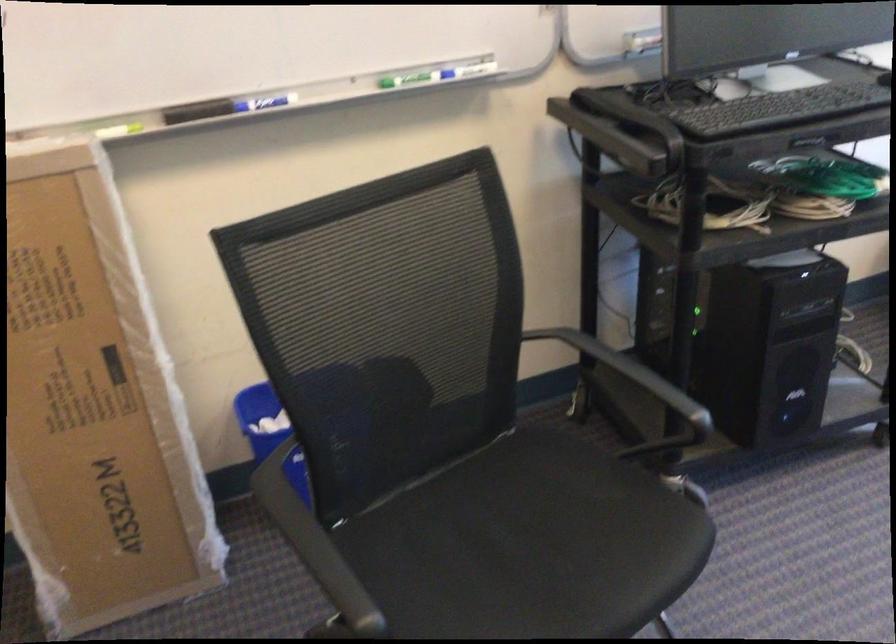
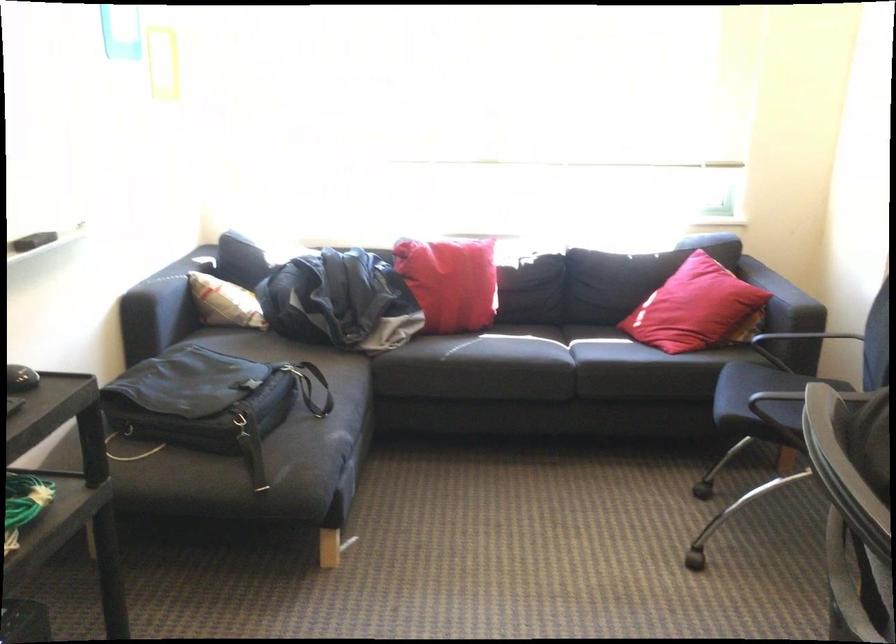
Question: The images are taken continuously from a first-person perspective. In which direction is your viewpoint rotating?

Choices:
 (A) Left
 (B) Right
 (C) Up
 (D) Down

Answer: (B)